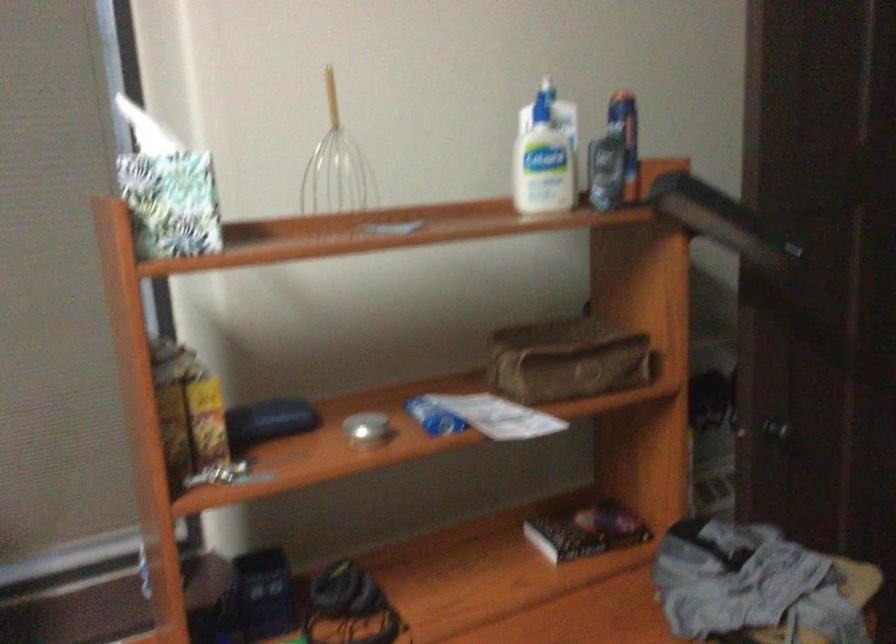
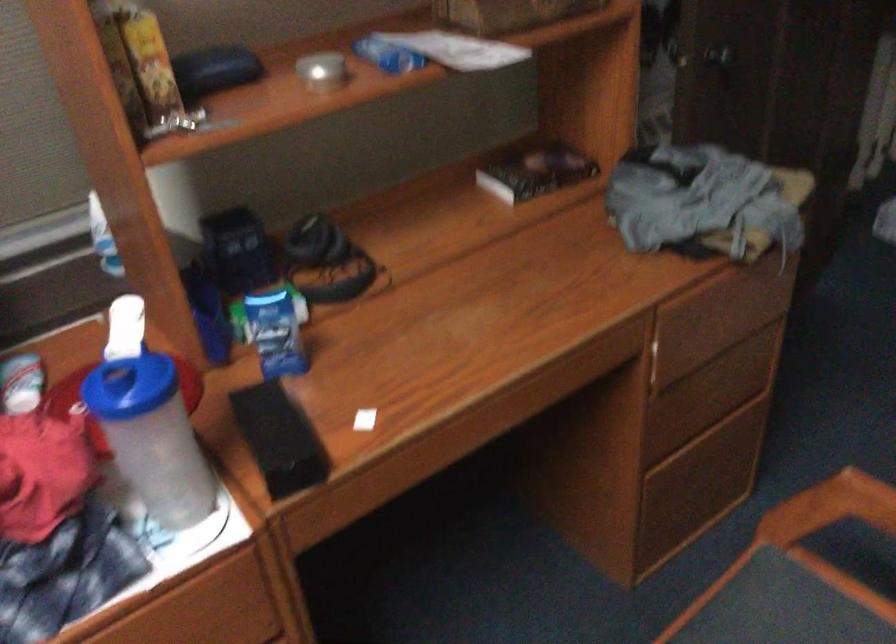
Locate, in the second image, the point that corresponds to pixel 776 428 in the first image.

(718, 55)